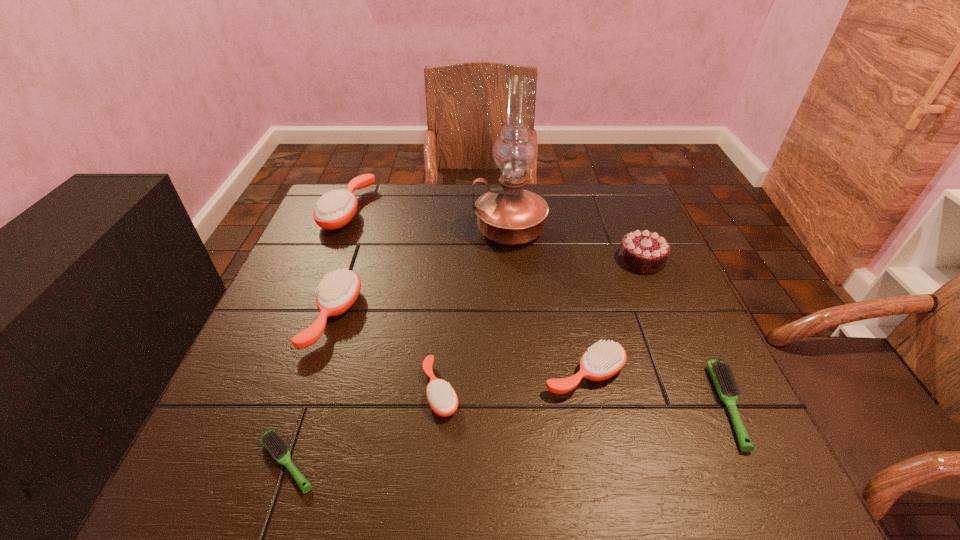
The width and height of the screenshot is (960, 540). What are the coordinates of `the tallest object` in the screenshot? It's located at (509, 215).

The width and height of the screenshot is (960, 540). In order to click on the farthest orange hairbrush in this screenshot , I will do `click(334, 210)`.

Image resolution: width=960 pixels, height=540 pixels. I want to click on the tallest hairbrush, so click(334, 210).

Locate an element on the screen. chocolate chocolate cake is located at coordinates (645, 252).

This screenshot has width=960, height=540. What are the coordinates of `the third smallest orange hairbrush` in the screenshot? It's located at [338, 291].

What are the coordinates of `the fourth tallest object` in the screenshot? It's located at (338, 291).

The width and height of the screenshot is (960, 540). Find the location of `the third biggest orange hairbrush`. the third biggest orange hairbrush is located at coordinates (602, 360).

Find the location of a particular element. This screenshot has height=540, width=960. the fifth hairbrush from left to right is located at coordinates (602, 360).

You are a GUI agent. You are given a task and a screenshot of the screen. Output one action in this format:
    pyautogui.click(x=<x>, y=<y>)
    Task: Click on the smallest orange hairbrush
    Image resolution: width=960 pixels, height=540 pixels.
    Given the screenshot: What is the action you would take?
    pyautogui.click(x=442, y=398)

This screenshot has height=540, width=960. Find the location of `the second orange hairbrush from right to left`. the second orange hairbrush from right to left is located at coordinates (442, 398).